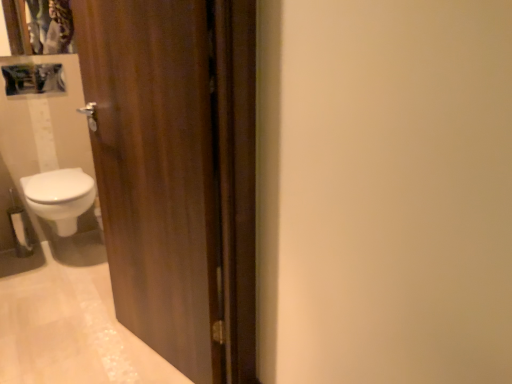
Question: Is white matte toilet paper at lower left positioned beyond the bounds of wooden door at left?

Choices:
 (A) no
 (B) yes

Answer: (B)

Question: Does white matte toilet paper at lower left have a lesser height compared to wooden door at left?

Choices:
 (A) yes
 (B) no

Answer: (A)

Question: Is the position of white matte toilet paper at lower left less distant than that of wooden door at left?

Choices:
 (A) no
 (B) yes

Answer: (A)

Question: Could you tell me if white matte toilet paper at lower left is turned towards wooden door at left?

Choices:
 (A) yes
 (B) no

Answer: (B)

Question: Does white matte toilet paper at lower left have a smaller size compared to wooden door at left?

Choices:
 (A) no
 (B) yes

Answer: (B)

Question: From a real-world perspective, is white glossy bidet at lower left above or below wooden door at left?

Choices:
 (A) above
 (B) below

Answer: (B)

Question: In the image, is white glossy bidet at lower left positioned in front of or behind wooden door at left?

Choices:
 (A) front
 (B) behind

Answer: (B)

Question: Is white glossy bidet at lower left wider or thinner than wooden door at left?

Choices:
 (A) wide
 (B) thin

Answer: (A)

Question: In the image, is white glossy bidet at lower left on the left side or the right side of wooden door at left?

Choices:
 (A) left
 (B) right

Answer: (A)

Question: From the image's perspective, is matte plastic medicine cabinet at upper left positioned above or below white matte toilet paper at lower left?

Choices:
 (A) below
 (B) above

Answer: (B)

Question: Relative to white matte toilet paper at lower left, is matte plastic medicine cabinet at upper left in front or behind?

Choices:
 (A) behind
 (B) front

Answer: (B)

Question: Based on their sizes in the image, would you say matte plastic medicine cabinet at upper left is bigger or smaller than white matte toilet paper at lower left?

Choices:
 (A) small
 (B) big

Answer: (B)

Question: In terms of width, does matte plastic medicine cabinet at upper left look wider or thinner when compared to white matte toilet paper at lower left?

Choices:
 (A) thin
 (B) wide

Answer: (B)

Question: From a real-world perspective, is matte plastic medicine cabinet at upper left positioned above or below white glossy bidet at lower left?

Choices:
 (A) above
 (B) below

Answer: (A)

Question: Considering their positions, is matte plastic medicine cabinet at upper left located in front of or behind white glossy bidet at lower left?

Choices:
 (A) front
 (B) behind

Answer: (B)